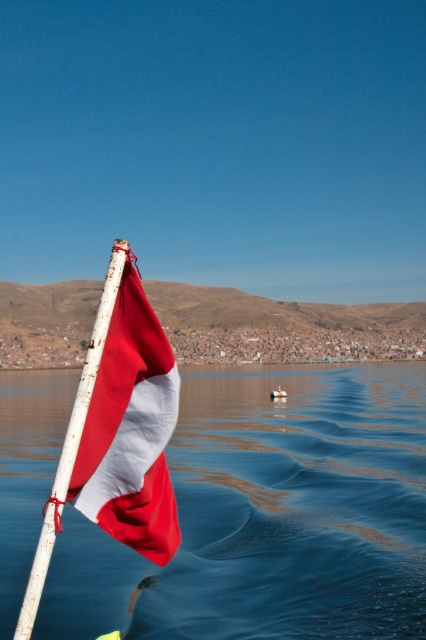
You are standing on the dock and looking at the blue water at lower left and the matte fabric flag at left. Which object is higher in the scene?

→ The blue water at lower left is taller than the matte fabric flag at left.